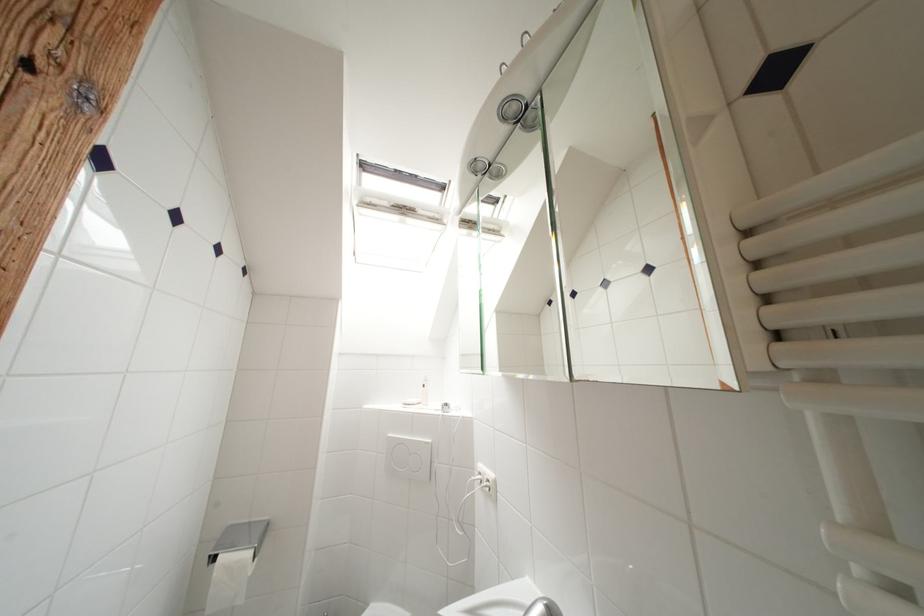
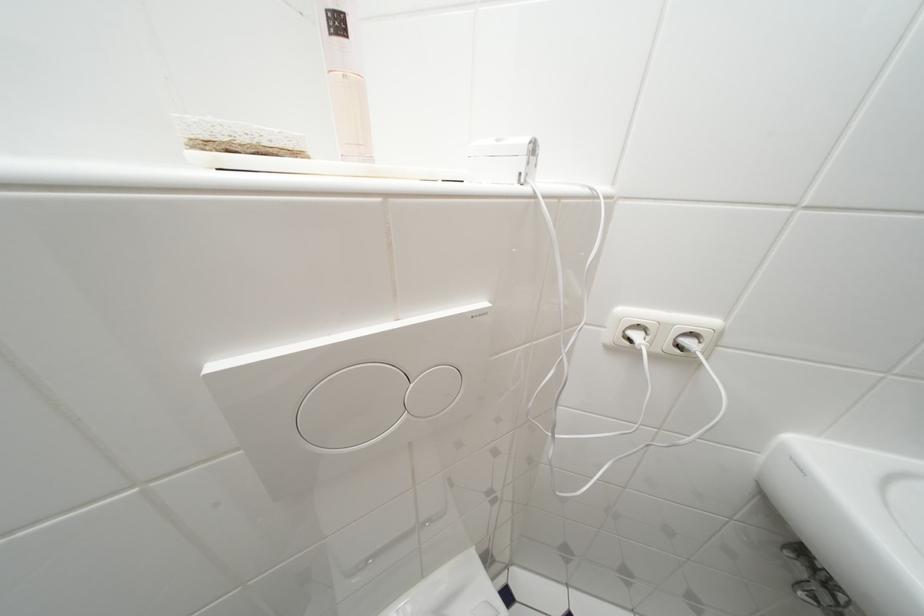
Find the pixel in the second image that matches point 431,389 in the first image.

(345, 26)